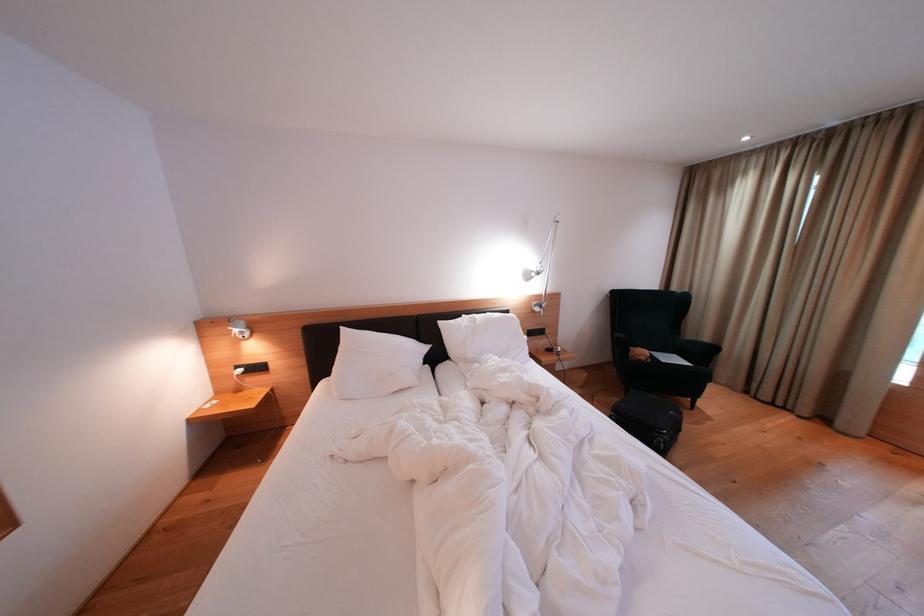
Find where to open the silver laptop. Please return your answer as a coordinate pair (x, y).

(670, 358)